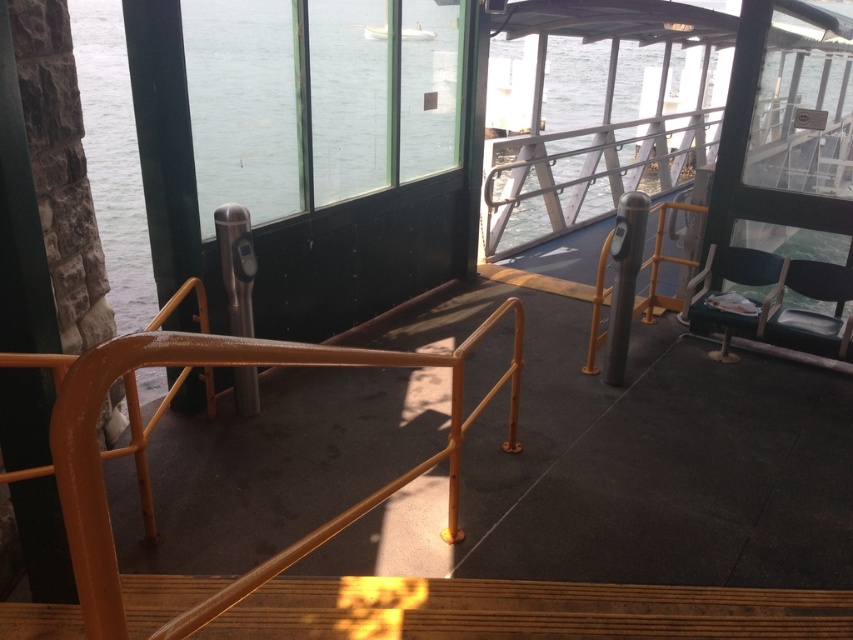
You are a passenger on the ferry and want to know if you can place your 1.2 meter wide luggage between the orange painted metal handrail at center and the white glossy boat at upper center. Can you fit it there?

The orange painted metal handrail at center is wider than the white glossy boat at upper center. However, the description does not provide specific measurements for the distance between them, so it is unclear if the 1.2 meter wide luggage will fit. Additional information about the space between the two objects is needed to determine this.